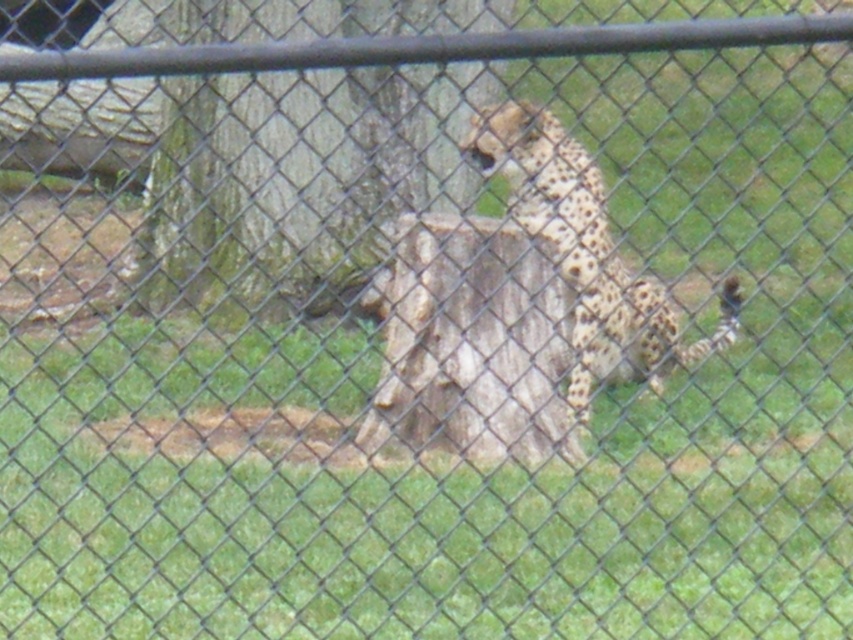
Which is more to the right, rough bark tree stump at center or spotted fur cheetah at center?

Positioned to the right is spotted fur cheetah at center.

Does rough bark tree stump at center appear on the right side of spotted fur cheetah at center?

Incorrect, rough bark tree stump at center is not on the right side of spotted fur cheetah at center.

Does point (271, 288) come closer to viewer compared to point (581, 224)?

No, it is not.

Find the location of a particular element. This screenshot has width=853, height=640. rough bark tree stump at center is located at coordinates (299, 173).